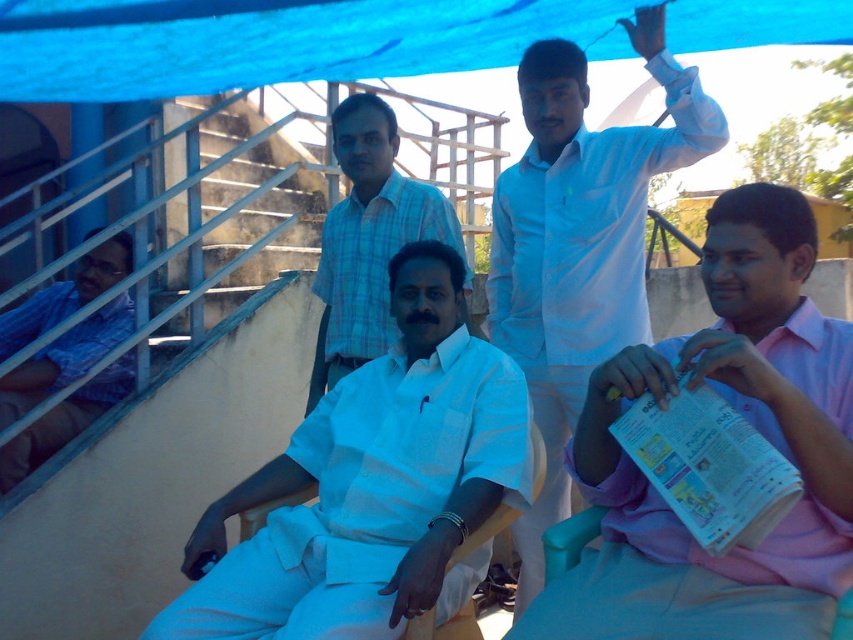
Is pink cotton shirt at lower right further to the viewer compared to white glossy shirt at upper center?

No, pink cotton shirt at lower right is in front of white glossy shirt at upper center.

Where is `pink cotton shirt at lower right`? This screenshot has width=853, height=640. pink cotton shirt at lower right is located at coordinates (751, 424).

Consider the image. Who is more forward, (843, 403) or (691, 90)?

Point (843, 403) is in front.

I want to click on pink cotton shirt at lower right, so click(751, 424).

Who is lower down, white glossy shirt at upper center or white cotton shirt at center?

white glossy shirt at upper center

Which is more to the right, white glossy shirt at upper center or white cotton shirt at center?

From the viewer's perspective, white glossy shirt at upper center appears more on the right side.

Is point (538, 154) positioned after point (329, 227)?

No, it is in front of (329, 227).

Identify the location of white glossy shirt at upper center. (579, 243).

Does pink cotton shirt at lower right have a greater width compared to white cotton shirt at center?

Yes.

Between point (589, 420) and point (332, 378), which one is positioned in front?

Point (589, 420)

Image resolution: width=853 pixels, height=640 pixels. I want to click on pink cotton shirt at lower right, so click(751, 424).

The height and width of the screenshot is (640, 853). Find the location of `pink cotton shirt at lower right`. pink cotton shirt at lower right is located at coordinates (751, 424).